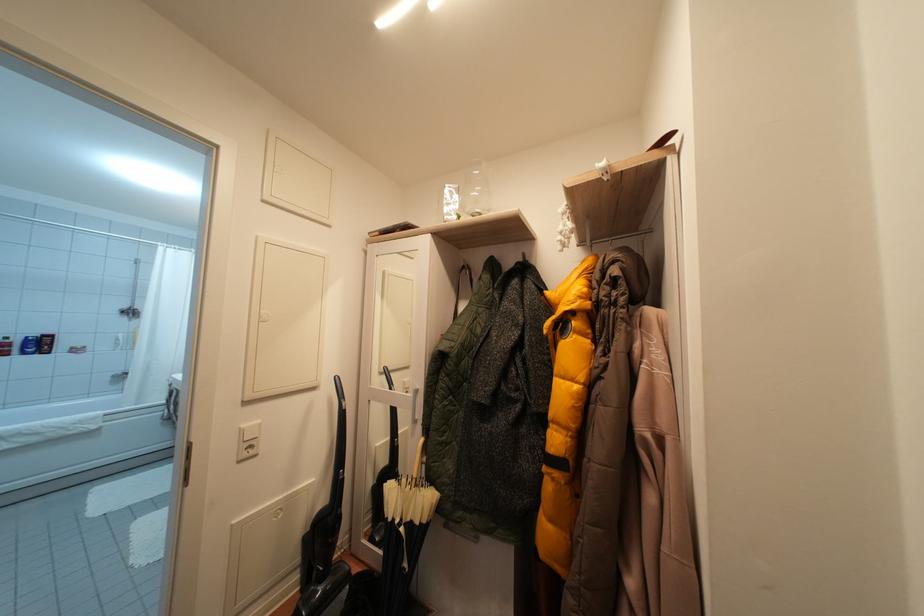
The width and height of the screenshot is (924, 616). Find the location of `cabinet door handle`. cabinet door handle is located at coordinates (416, 403).